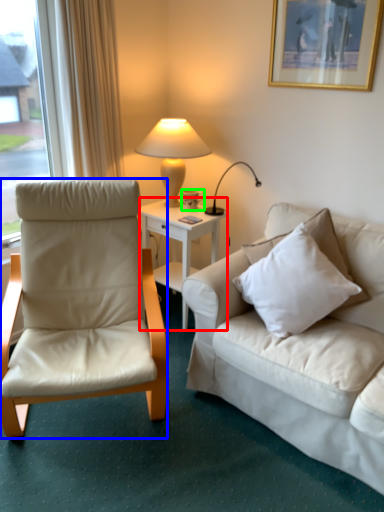
Question: Which object is positioned farthest from desk (highlighted by a red box)? Select from chair (highlighted by a blue box) and coffee cup (highlighted by a green box).

Choices:
 (A) chair
 (B) coffee cup

Answer: (A)